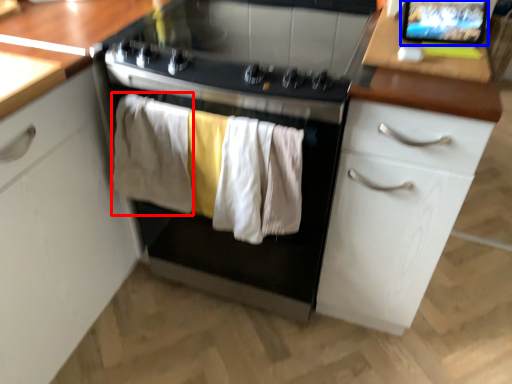
Question: Among these objects, which one is farthest to the camera, clothing (highlighted by a red box) or computer screen (highlighted by a blue box)?

Choices:
 (A) clothing
 (B) computer screen

Answer: (A)